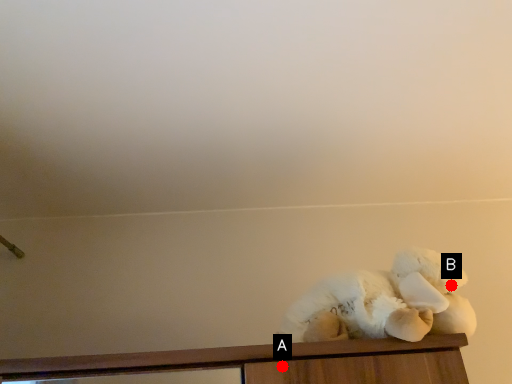
Question: Two points are circled on the image, labeled by A and B beside each circle. Which point is closer to the camera?

Choices:
 (A) A is closer
 (B) B is closer

Answer: (A)